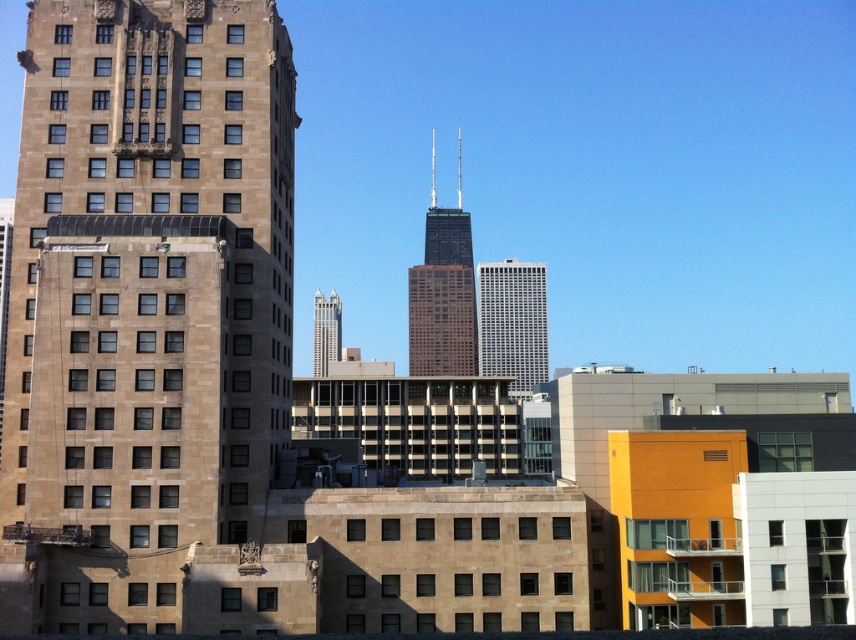
Question: Is brown stone building at left in front of white glass building at center?

Choices:
 (A) no
 (B) yes

Answer: (B)

Question: Which is farther from the white glass building at center?

Choices:
 (A) brown glassy tower at center
 (B) brown stone building at left
 (C) matte glass skyscraper at center

Answer: (B)

Question: Which point appears farthest from the camera in this image?

Choices:
 (A) (70, 618)
 (B) (408, 284)

Answer: (B)

Question: Can you confirm if brown glassy tower at center is smaller than white glass building at center?

Choices:
 (A) yes
 (B) no

Answer: (B)

Question: Which of the following is the farthest from the observer?

Choices:
 (A) (275, 598)
 (B) (322, 321)
 (C) (461, 241)
 (D) (519, 262)

Answer: (C)

Question: Can you confirm if brown stone building at left is wider than matte glass skyscraper at center?

Choices:
 (A) no
 (B) yes

Answer: (B)